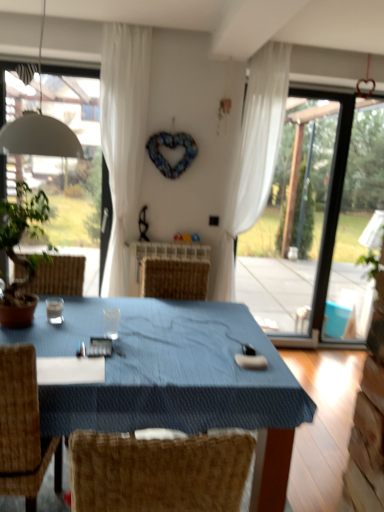
The height and width of the screenshot is (512, 384). I want to click on free spot above white sheer curtain at center, the second curtain in the right-to-left sequence (from a real-world perspective), so click(127, 19).